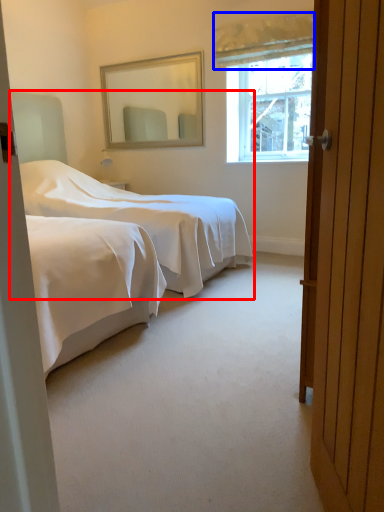
Question: Which object is further to the camera taking this photo, bed (highlighted by a red box) or curtain (highlighted by a blue box)?

Choices:
 (A) bed
 (B) curtain

Answer: (B)